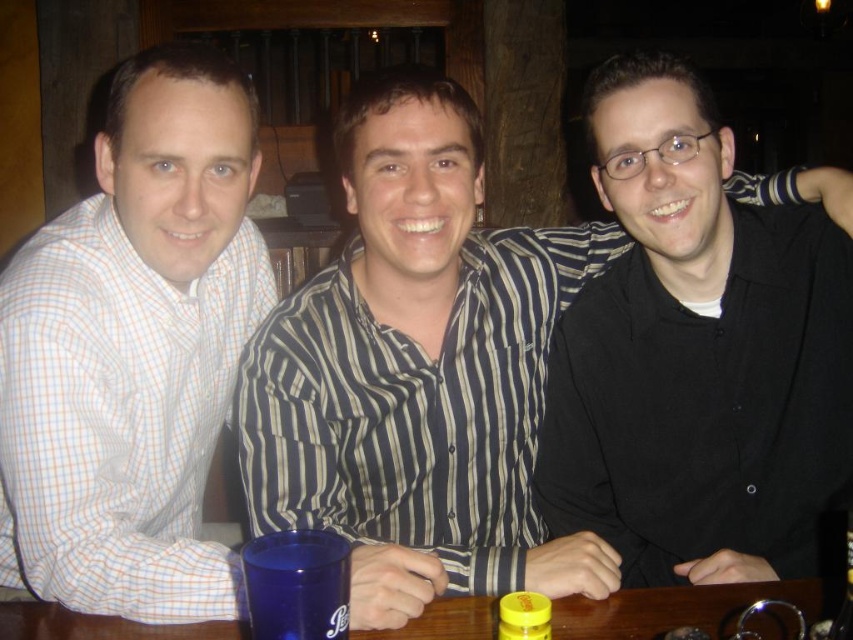
Question: Does black matte shirt at center appear over brown wooden table at center?

Choices:
 (A) yes
 (B) no

Answer: (A)

Question: Estimate the real-world distances between objects in this image. Which object is farther from the black matte shirt at center?

Choices:
 (A) striped shirt at center
 (B) light blue checkered shirt at left
 (C) brown wooden table at center
 (D) blue plastic cup at lower center

Answer: (D)

Question: From the image, what is the correct spatial relationship of black matte shirt at center in relation to blue plastic cup at lower center?

Choices:
 (A) left
 (B) right

Answer: (B)

Question: Can you confirm if striped shirt at center is smaller than yellow matte jar at lower center?

Choices:
 (A) yes
 (B) no

Answer: (B)

Question: Among these points, which one is nearest to the camera?

Choices:
 (A) [496, 259]
 (B) [614, 332]

Answer: (B)

Question: Which is farther from the light blue checkered shirt at left?

Choices:
 (A) striped shirt at center
 (B) black matte shirt at center
 (C) brown wooden table at center
 (D) blue plastic cup at lower center

Answer: (B)